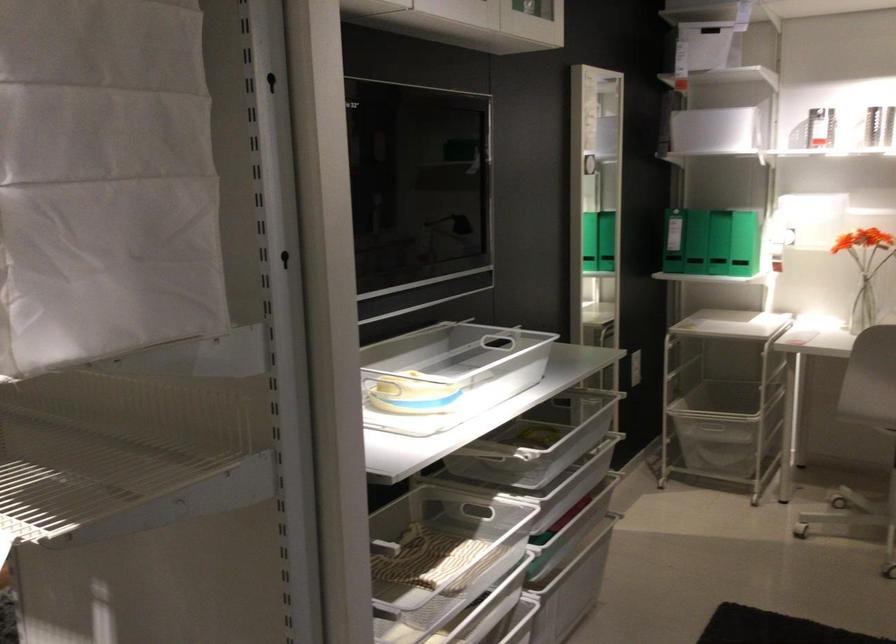
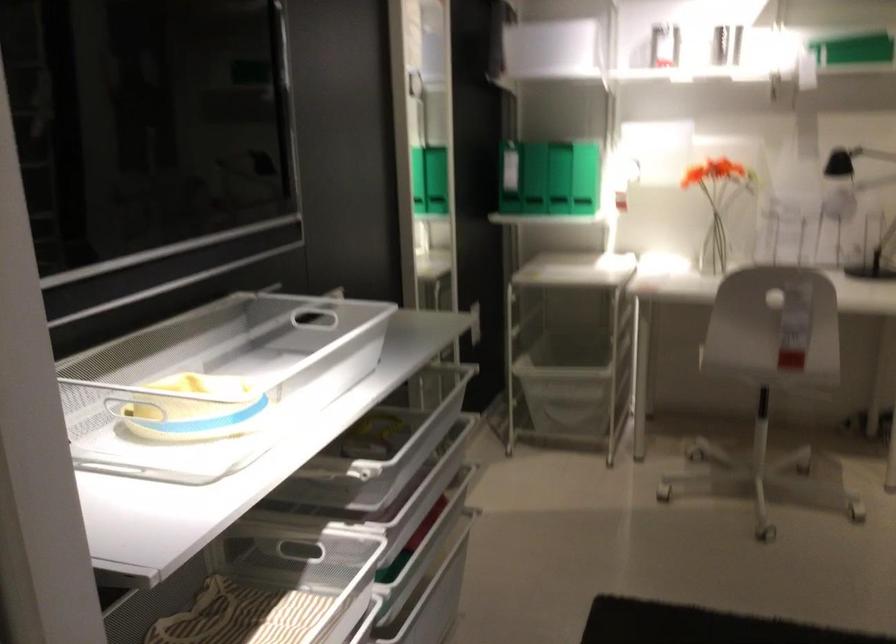
In the second image, find the point that corresponds to (711,234) in the first image.

(533, 178)